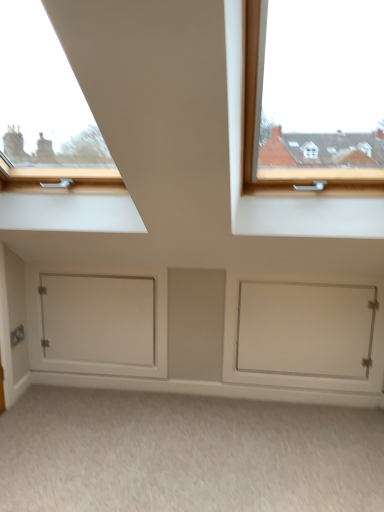
Question: Does white matte door at lower right, the first door when ordered from right to left, have a lesser width compared to beige carpet at lower center?

Choices:
 (A) no
 (B) yes

Answer: (B)

Question: Is white matte door at lower right, which is the second door in left-to-right order, looking in the opposite direction of beige carpet at lower center?

Choices:
 (A) no
 (B) yes

Answer: (A)

Question: From the image's perspective, would you say white matte door at lower right, which is the second door in left-to-right order, is positioned over beige carpet at lower center?

Choices:
 (A) yes
 (B) no

Answer: (A)

Question: Considering the relative sizes of white matte door at lower right, which is the second door in left-to-right order, and beige carpet at lower center in the image provided, is white matte door at lower right, which is the second door in left-to-right order, taller than beige carpet at lower center?

Choices:
 (A) yes
 (B) no

Answer: (A)

Question: Is white matte door at lower right, which is the second door in left-to-right order, to the left of beige carpet at lower center from the viewer's perspective?

Choices:
 (A) no
 (B) yes

Answer: (A)

Question: Can you confirm if white matte door at lower right, the first door when ordered from right to left, is positioned to the right of beige carpet at lower center?

Choices:
 (A) yes
 (B) no

Answer: (A)

Question: From the image's perspective, is white matte door at lower left, which is the 2th door in right-to-left order, on beige carpet at lower center?

Choices:
 (A) no
 (B) yes

Answer: (B)

Question: From the image's perspective, does white matte door at lower left, which is the 2th door in right-to-left order, appear lower than beige carpet at lower center?

Choices:
 (A) no
 (B) yes

Answer: (A)

Question: Is the position of white matte door at lower left, which is the 2th door in right-to-left order, more distant than that of beige carpet at lower center?

Choices:
 (A) yes
 (B) no

Answer: (A)

Question: From a real-world perspective, is white matte door at lower left, which is the 2th door in right-to-left order, on top of beige carpet at lower center?

Choices:
 (A) no
 (B) yes

Answer: (B)

Question: Is white matte door at lower left, the first door when ordered from left to right, not near beige carpet at lower center?

Choices:
 (A) no
 (B) yes

Answer: (A)

Question: Can you confirm if white matte door at lower left, which is the 2th door in right-to-left order, is thinner than beige carpet at lower center?

Choices:
 (A) no
 (B) yes

Answer: (B)

Question: From a real-world perspective, is beige carpet at lower center below white matte door at lower right, which is the second door in left-to-right order?

Choices:
 (A) yes
 (B) no

Answer: (A)